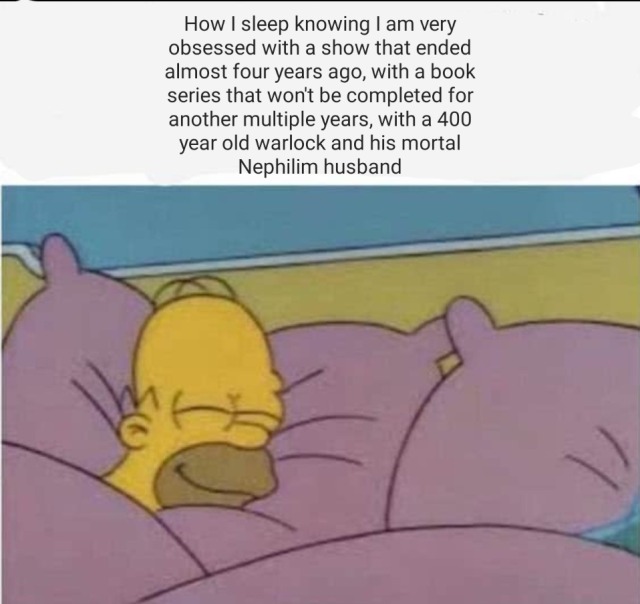
Locate an element on the screen. Image resolution: width=640 pixels, height=604 pixels. purple pillow is located at coordinates (362, 373).